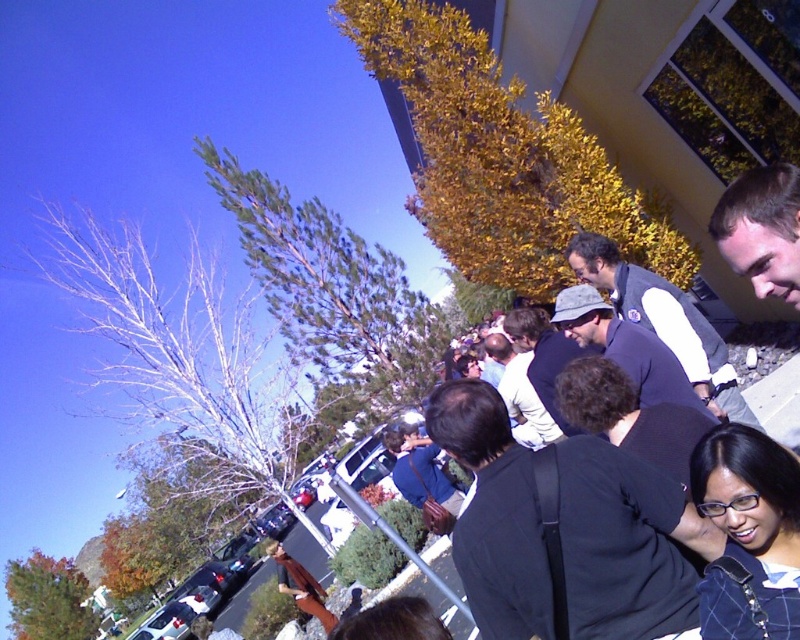
Question: Is matte black hat at center to the right of dark blue shirt at center from the viewer's perspective?

Choices:
 (A) no
 (B) yes

Answer: (B)

Question: Is black matte jacket at center further to camera compared to matte black hat at center?

Choices:
 (A) no
 (B) yes

Answer: (A)

Question: Estimate the real-world distances between objects in this image. Which object is closer to the matte black hat at center?

Choices:
 (A) dark blue shirt at center
 (B) black matte jacket at center

Answer: (A)

Question: Estimate the real-world distances between objects in this image. Which object is closer to the black matte jacket at center?

Choices:
 (A) matte black hat at center
 (B) dark blue shirt at center

Answer: (A)

Question: Which point is farther to the camera?

Choices:
 (A) (560, 332)
 (B) (656, 544)
 (C) (596, 300)

Answer: (A)

Question: Does black matte jacket at center have a lesser width compared to matte black hat at center?

Choices:
 (A) yes
 (B) no

Answer: (B)